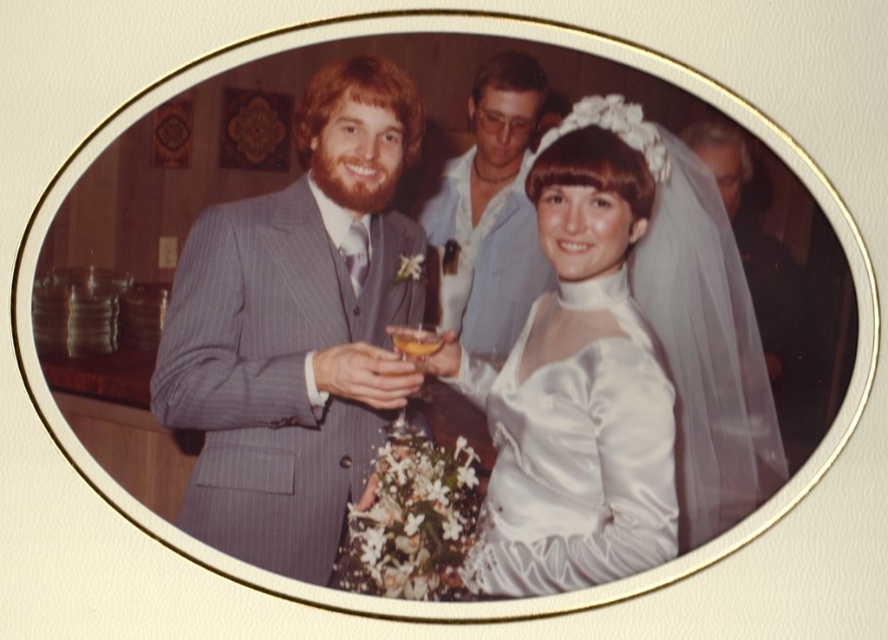
You are a photographer who wants to capture a clear shot of the light blue shirt at center and the translucent glass at center. Which object should you focus on first to ensure both are in focus?

The light blue shirt at center is closer to the viewer than the translucent glass at center. To ensure both are in focus, focus on the light blue shirt at center first, as it is closer, and the translucent glass at center will be in the depth of field behind it.

You are attending a wedding and notice the light blue shirt at center. Can you determine its exact position in the image using the coordinate system provided?

The light blue shirt at center is located at point (493, 204).